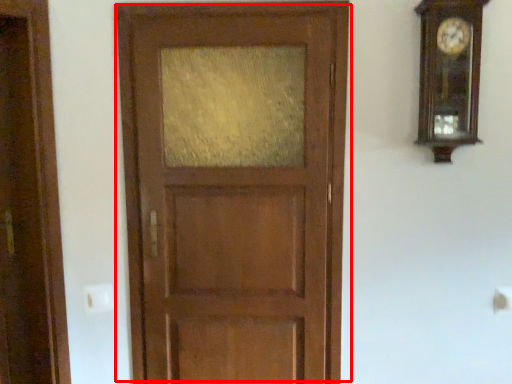
Question: From the image's perspective, what is the correct spatial positioning of door (annotated by the red box) in reference to clock?

Choices:
 (A) above
 (B) below

Answer: (B)